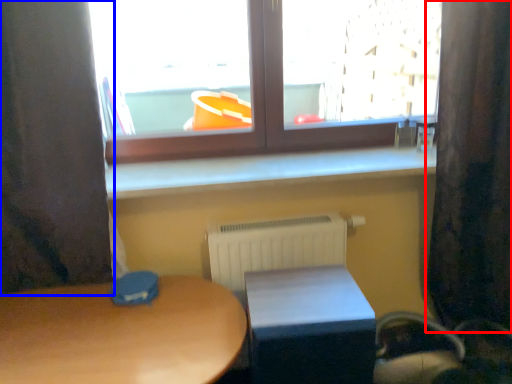
Question: Which point is further to the camera, curtain (highlighted by a red box) or curtain (highlighted by a blue box)?

Choices:
 (A) curtain
 (B) curtain

Answer: (A)